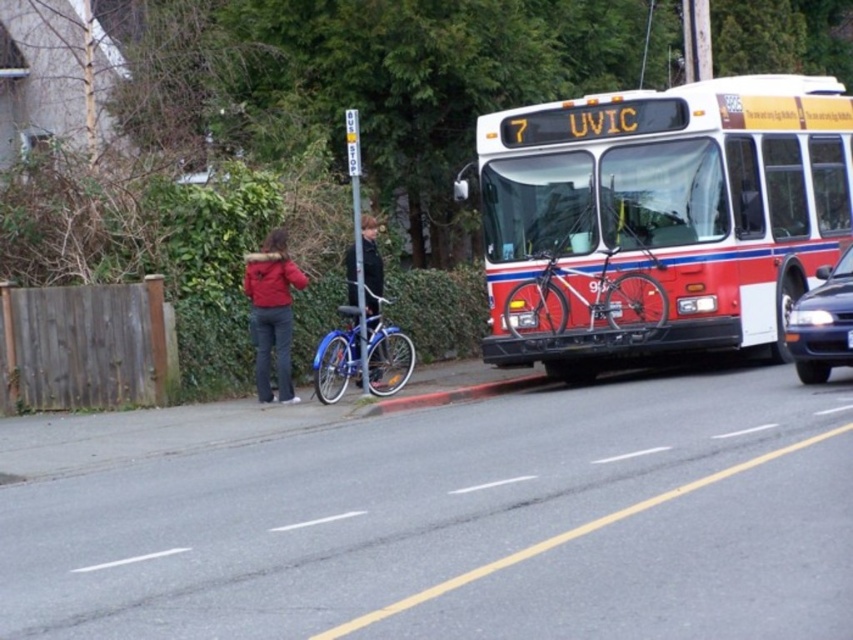
Question: Can you confirm if matte red jacket at left is smaller than shiny black sedan at right?

Choices:
 (A) yes
 (B) no

Answer: (A)

Question: Estimate the real-world distances between objects in this image. Which object is closer to the matte red jacket at left?

Choices:
 (A) red matte bus at upper right
 (B) matte blue bicycle at center

Answer: (B)

Question: Can you confirm if matte blue bicycle at center is bigger than red painted concrete curb at lower center?

Choices:
 (A) no
 (B) yes

Answer: (A)

Question: Which point is farther to the camera?

Choices:
 (A) (399, 401)
 (B) (635, 321)
 (C) (849, 339)
 (D) (376, 234)

Answer: (D)

Question: Among these objects, which one is nearest to the camera?

Choices:
 (A) red painted concrete curb at lower center
 (B) blue metallic bicycle at center
 (C) shiny metallic bicycle at center

Answer: (A)

Question: Can you confirm if blue metallic bicycle at center is wider than shiny black sedan at right?

Choices:
 (A) no
 (B) yes

Answer: (B)